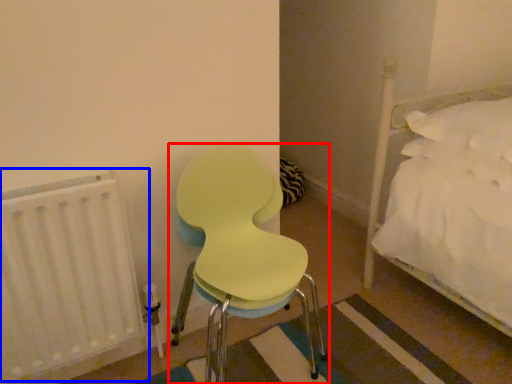
Question: Which object is closer to the camera taking this photo, chair (highlighted by a red box) or radiator (highlighted by a blue box)?

Choices:
 (A) chair
 (B) radiator

Answer: (A)